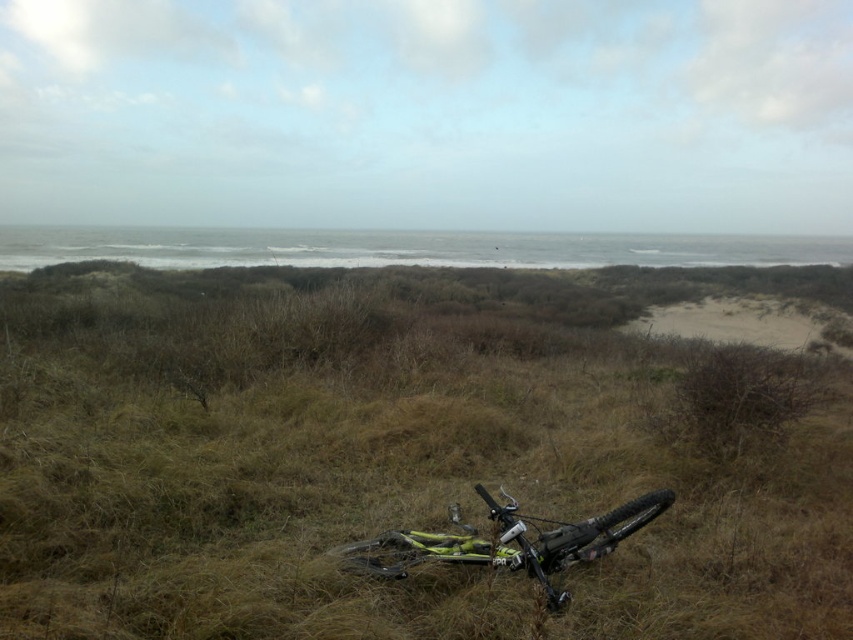
Question: Which of the following is the farthest from the observer?

Choices:
 (A) (491, 520)
 (B) (242, 541)

Answer: (B)

Question: Which of the following is the closest to the observer?

Choices:
 (A) (357, 570)
 (B) (288, 436)

Answer: (A)

Question: Is green matte grass at center to the left of yellow matte bicycle at center from the viewer's perspective?

Choices:
 (A) no
 (B) yes

Answer: (A)

Question: Is green matte grass at center further to the viewer compared to yellow matte bicycle at center?

Choices:
 (A) no
 (B) yes

Answer: (A)

Question: Which object is farther from the camera taking this photo?

Choices:
 (A) yellow matte bicycle at center
 (B) green matte grass at center

Answer: (A)

Question: Does green matte grass at center lie in front of yellow matte bicycle at center?

Choices:
 (A) no
 (B) yes

Answer: (B)